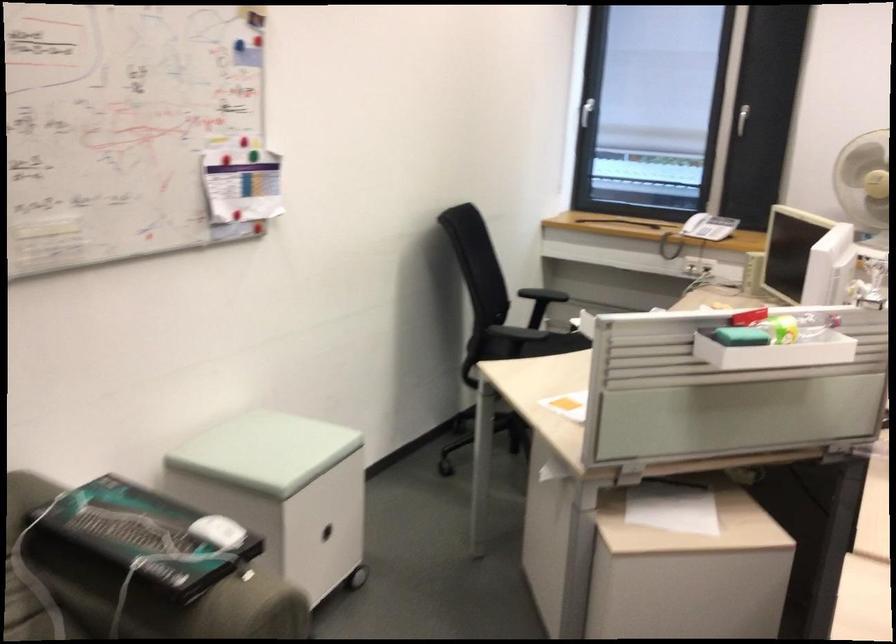
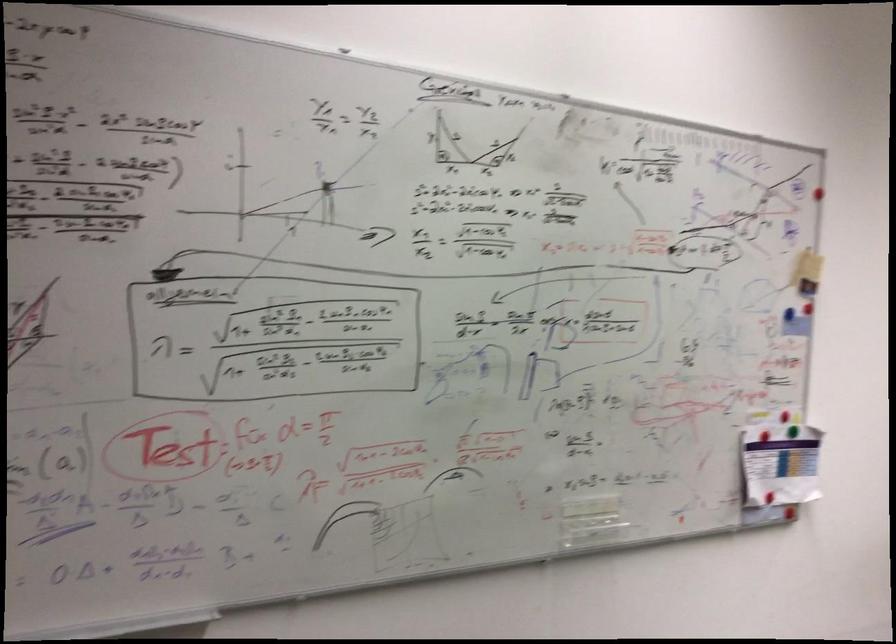
In the second image, find the point that corresponds to pixel 238 185 in the first image.

(780, 464)